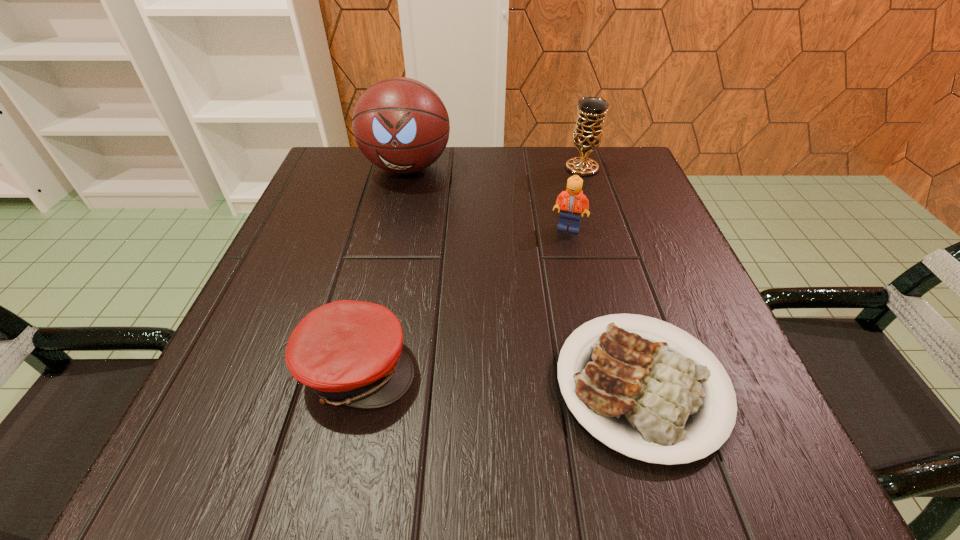
I want to click on free space located 0.120m on the back of the shortest object, so click(x=604, y=264).

What are the coordinates of `basketball that is positioned at the far edge` in the screenshot? It's located at (401, 125).

Locate an element on the screen. The image size is (960, 540). chalice positioned at the far edge is located at coordinates (x=588, y=131).

Find the location of a particular element. Image resolution: width=960 pixels, height=540 pixels. object present at the near edge is located at coordinates (652, 400).

This screenshot has width=960, height=540. Find the location of `basketball that is positioned at the left edge`. basketball that is positioned at the left edge is located at coordinates (401, 125).

In order to click on cap that is at the left edge in this screenshot , I will do `click(349, 352)`.

Locate an element on the screen. The height and width of the screenshot is (540, 960). chalice at the right edge is located at coordinates (588, 131).

The width and height of the screenshot is (960, 540). I want to click on plate at the right edge, so click(x=652, y=400).

Find the location of a particular element. object situated at the far left corner is located at coordinates [x=401, y=125].

Locate an element on the screen. object that is positioned at the far right corner is located at coordinates (588, 131).